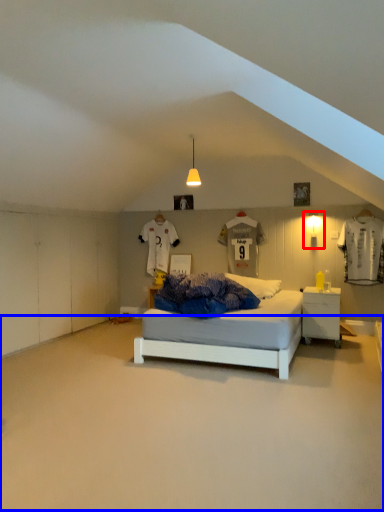
Question: Which point is closer to the camera, light fixture (highlighted by a red box) or plain (highlighted by a blue box)?

Choices:
 (A) light fixture
 (B) plain

Answer: (B)